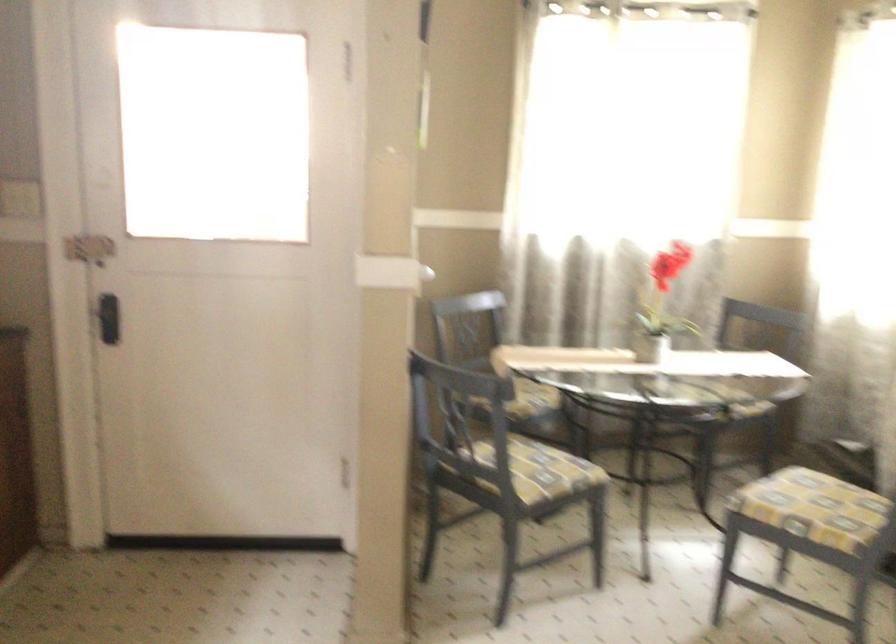
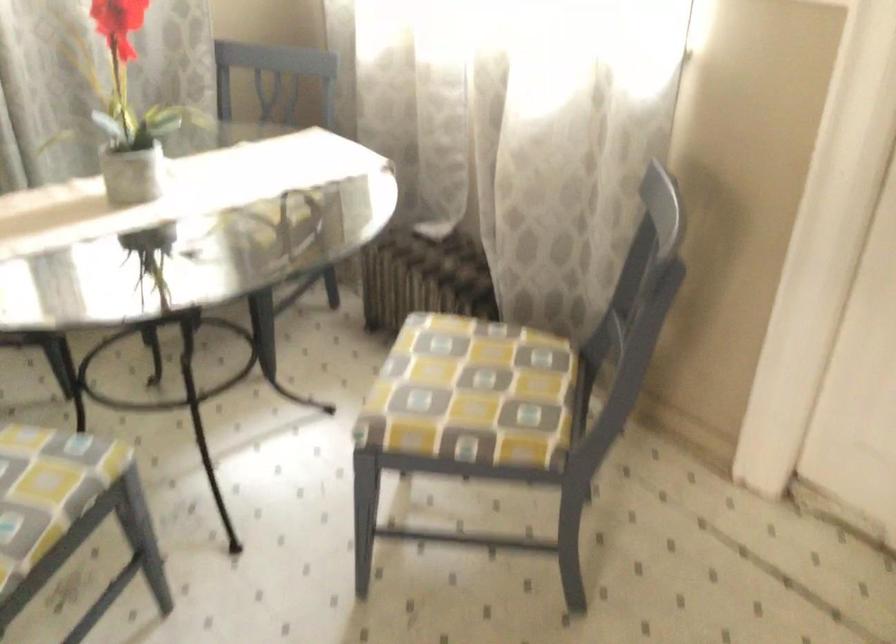
Question: I am providing you with two images of the same scene from different viewpoints. After the viewpoint changes to image2, which objects are now occluded?

Choices:
 (A) chair sitting surface
 (B) grey flower pot
 (C) small flower pot
 (D) monopoly game box

Answer: (C)